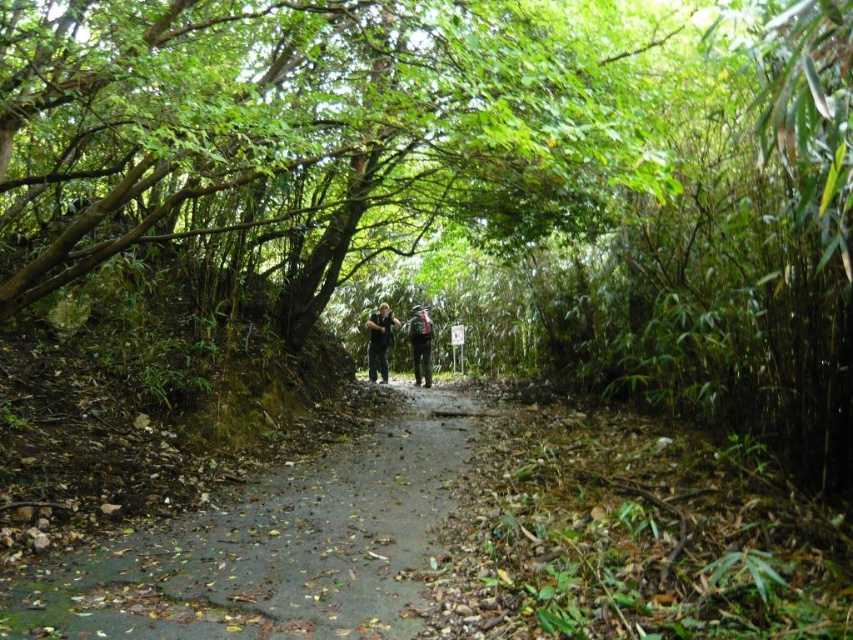
Question: Which of these objects is positioned closest to the green leafy tree at center?

Choices:
 (A) dark green fabric jacket at center
 (B) dull gray concrete path at center

Answer: (B)

Question: Which point is farther to the camera?

Choices:
 (A) (427, 337)
 (B) (291, 490)

Answer: (A)

Question: Is dark gray jacket at center to the right of dark green fabric jacket at center from the viewer's perspective?

Choices:
 (A) no
 (B) yes

Answer: (A)

Question: Which of these objects is positioned farthest from the dark gray jacket at center?

Choices:
 (A) green leafy tree at center
 (B) dull gray concrete path at center
 (C) dark green fabric jacket at center

Answer: (A)

Question: Is green leafy tree at center below dull gray concrete path at center?

Choices:
 (A) yes
 (B) no

Answer: (B)

Question: Is green leafy tree at center wider than dull gray concrete path at center?

Choices:
 (A) yes
 (B) no

Answer: (A)